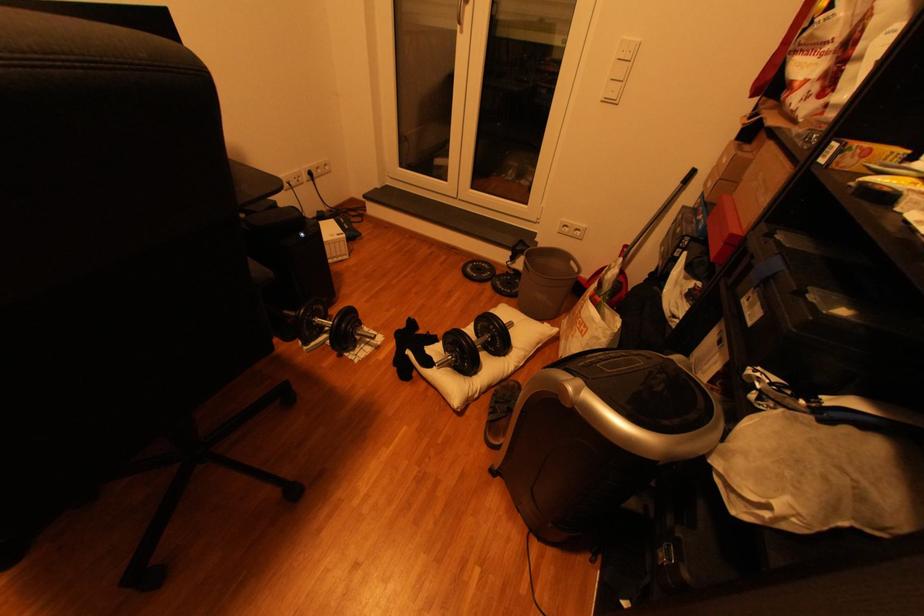
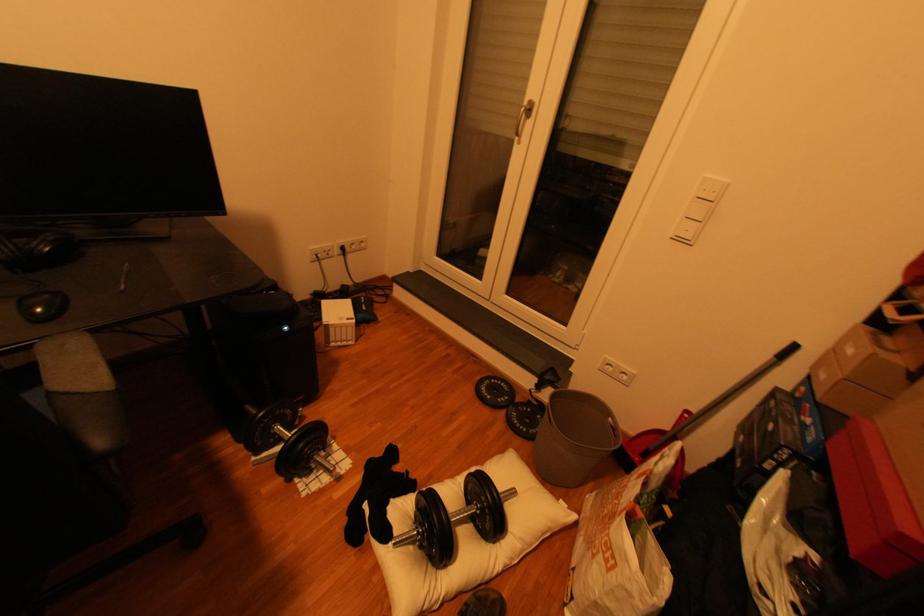
In the second image, find the point that corresponds to the point at 445,361 in the first image.

(406, 533)